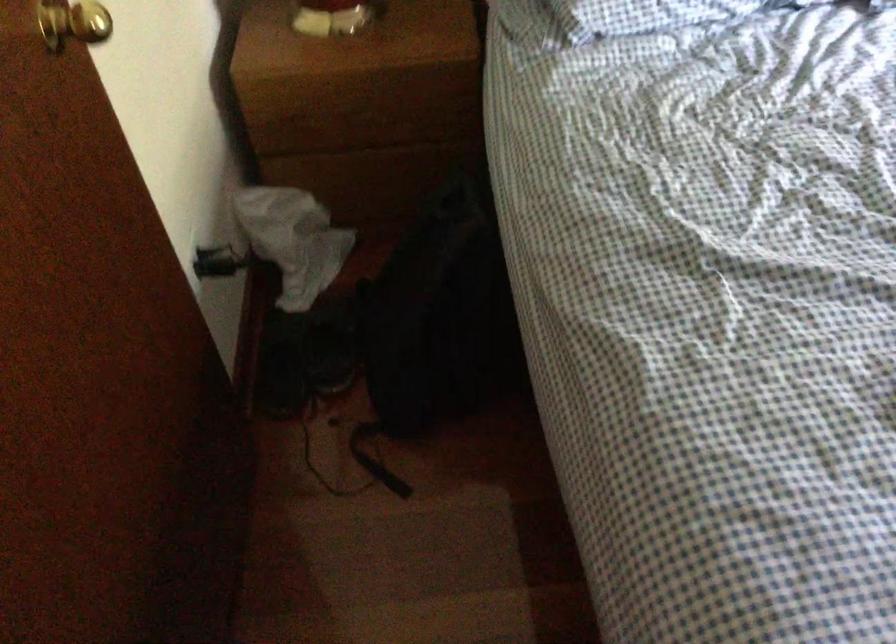
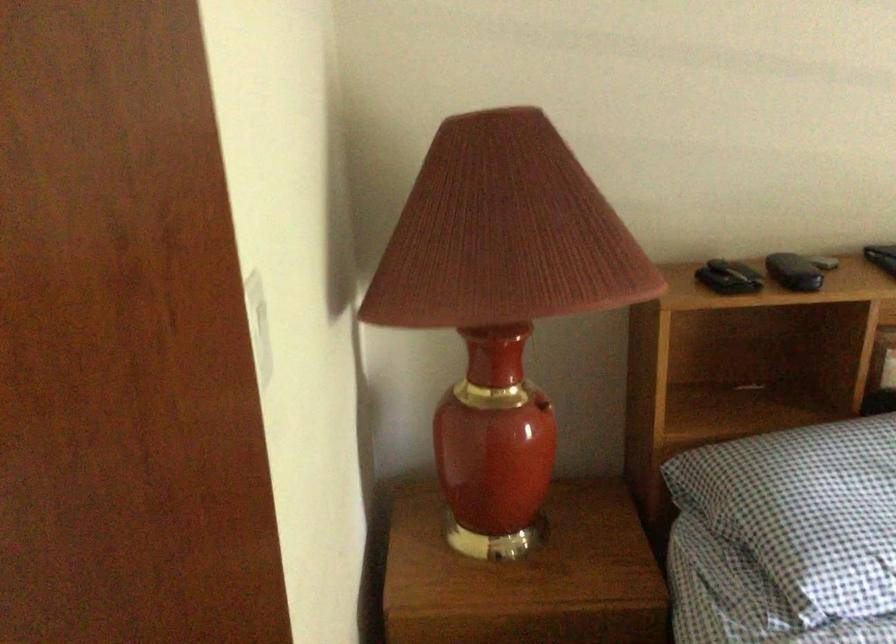
The images are taken continuously from a first-person perspective. In which direction are you moving?

The cameraman moved toward left, forward.